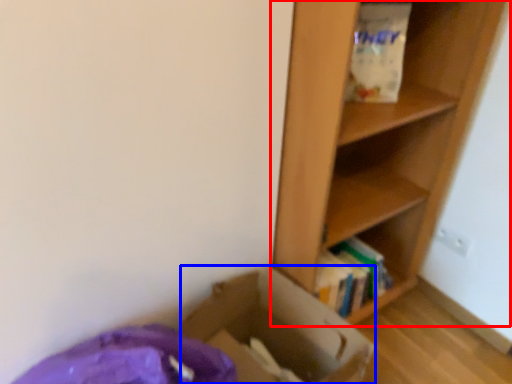
Question: Which point is further to the camera, shelf (highlighted by a red box) or cardboard box (highlighted by a blue box)?

Choices:
 (A) shelf
 (B) cardboard box

Answer: (B)